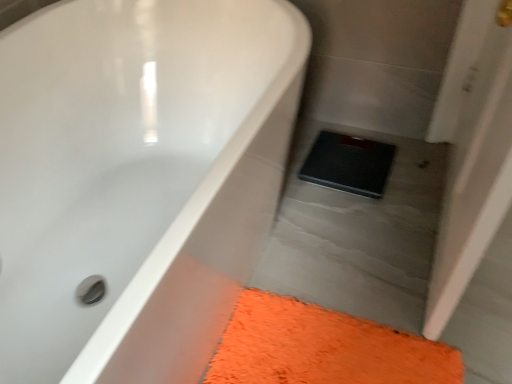
You are a GUI agent. You are given a task and a screenshot of the screen. Output one action in this format:
    pyautogui.click(x=<x>, y=<y>)
    Task: Click on the blank space situated above black rubber scale at center (from a real-world perspective)
    
    Given the screenshot: What is the action you would take?
    pyautogui.click(x=353, y=162)